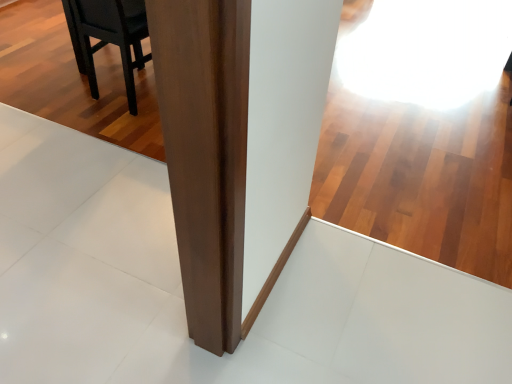
Measure the distance between dark wood chair at upper left and camera.

The distance of dark wood chair at upper left from camera is 1.94 meters.

Locate an element on the screen. Image resolution: width=512 pixels, height=384 pixels. dark wood chair at upper left is located at coordinates (109, 37).

What do you see at coordinates (109, 37) in the screenshot?
I see `dark wood chair at upper left` at bounding box center [109, 37].

At what (x,y) coordinates should I click in order to perform the action: click on dark wood chair at upper left. Please return your answer as a coordinate pair (x, y). The width and height of the screenshot is (512, 384). Looking at the image, I should click on [109, 37].